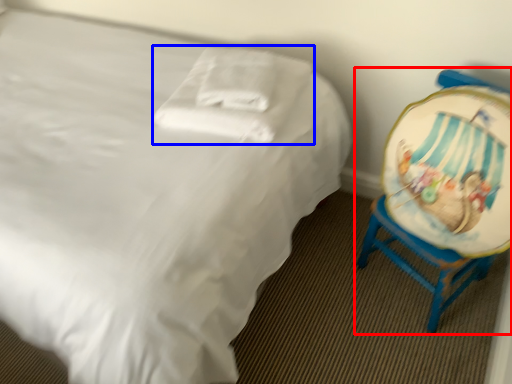
Question: Among these objects, which one is farthest to the camera, chair (highlighted by a red box) or pillow (highlighted by a blue box)?

Choices:
 (A) chair
 (B) pillow

Answer: (B)